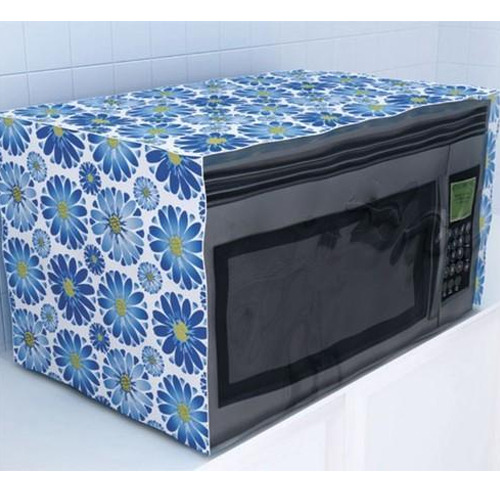
The height and width of the screenshot is (500, 500). Identify the location of handle of microwave. (444, 248).